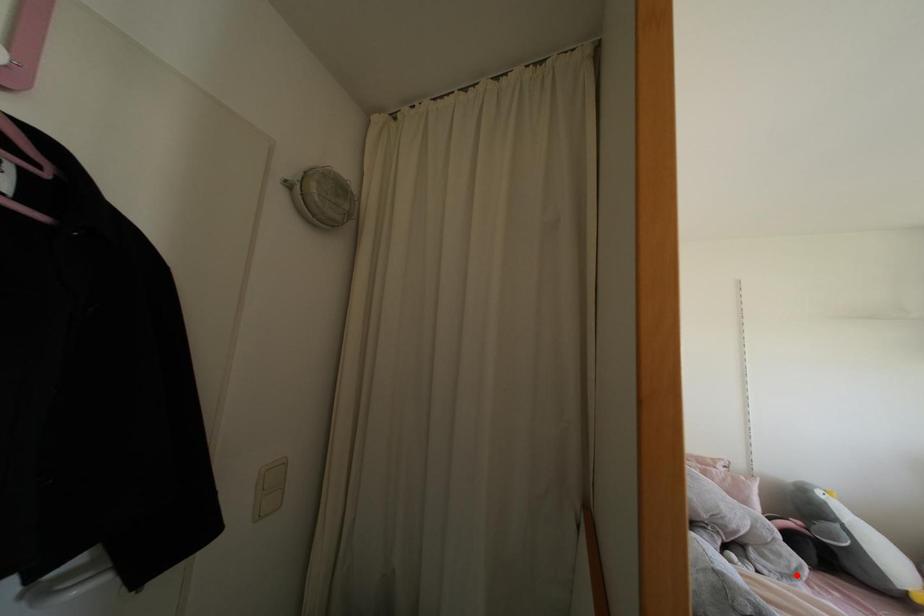
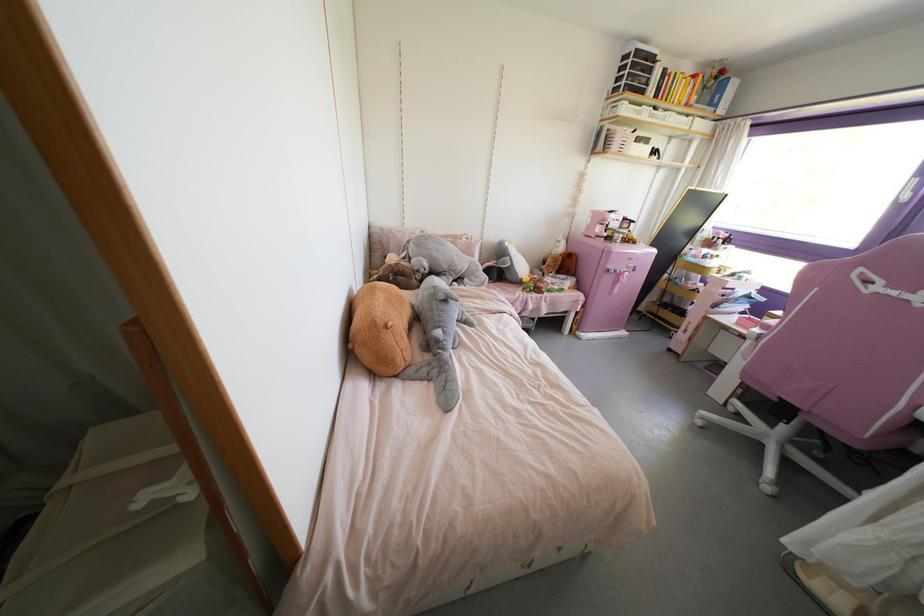
Question: A red point is marked in image1. In image2, is the corresponding 3D point closer to the camera or farther? Reply with the corresponding letter.

Choices:
 (A) The corresponding 3D point is closer.
 (B) The corresponding 3D point is farther.

Answer: (B)